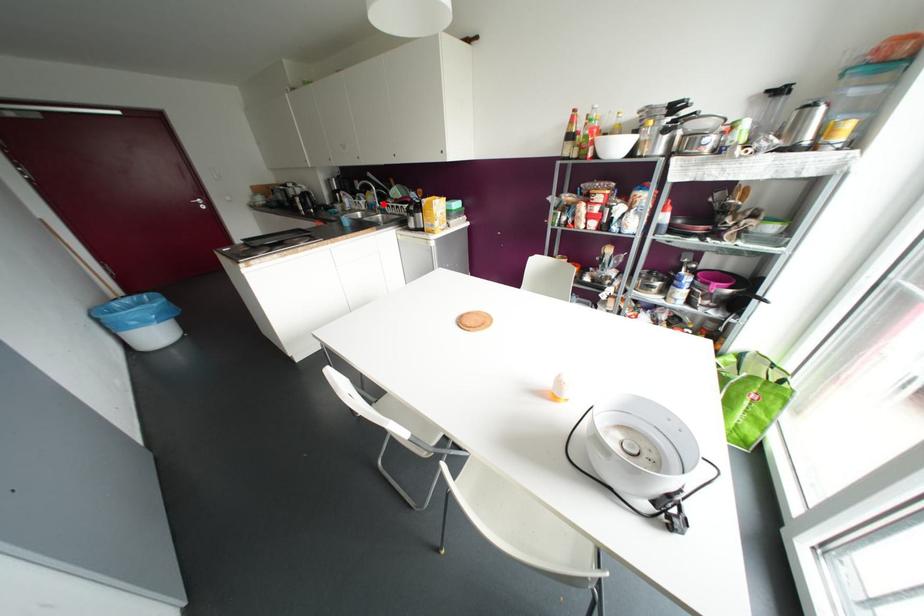
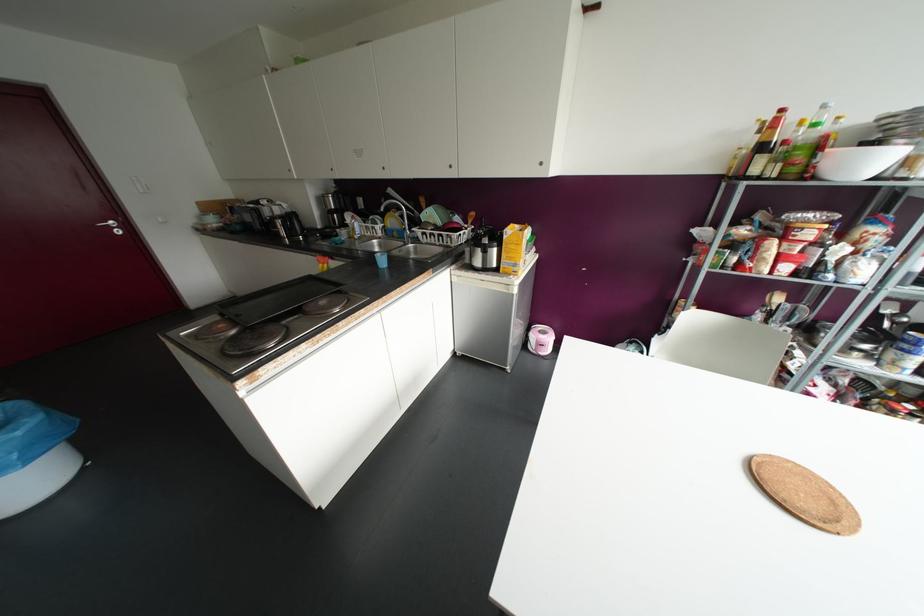
Question: I am providing you with two images of the same scene from different viewpoints. A red point is marked on the first image. At the location where the point appears in image 1, is it still visible in image 2?

Choices:
 (A) Yes
 (B) No

Answer: (A)